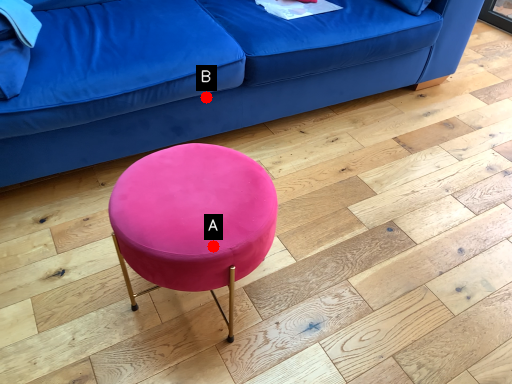
Question: Two points are circled on the image, labeled by A and B beside each circle. Which point is farther to the camera?

Choices:
 (A) A is further
 (B) B is further

Answer: (B)